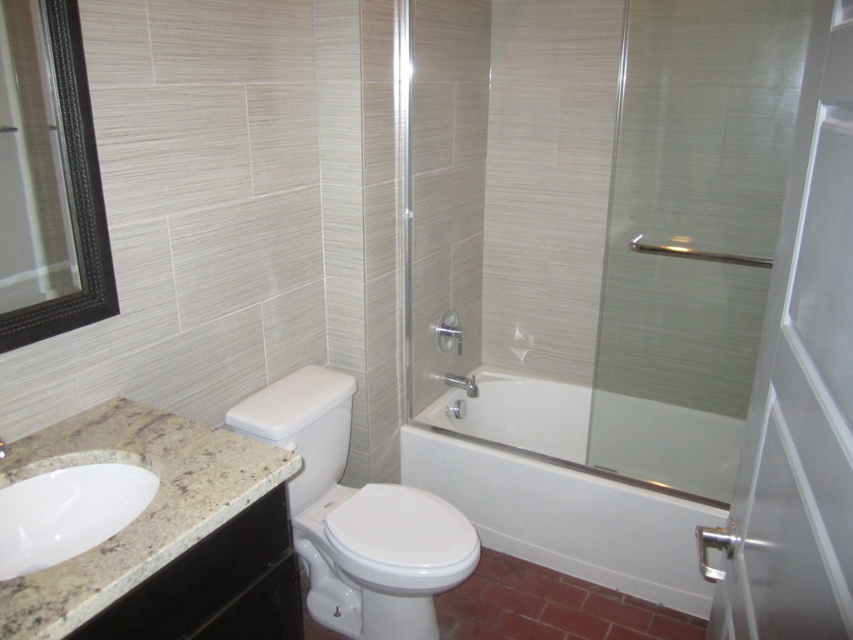
You are standing in the bathroom and want to determine which of the two points, point (407, 586) or point (119, 486), is closer to you. Based on their positions, which point is nearer?

Point (119, 486) is closer to you because it is less further to the camera than point (407, 586).

You are standing in the bathroom and want to wash your hands. Which object should you approach first, the white glossy toilet at center or the white marble sink at lower left?

You should approach the white marble sink at lower left first because it is closer to you than the white glossy toilet at center, which is further away.